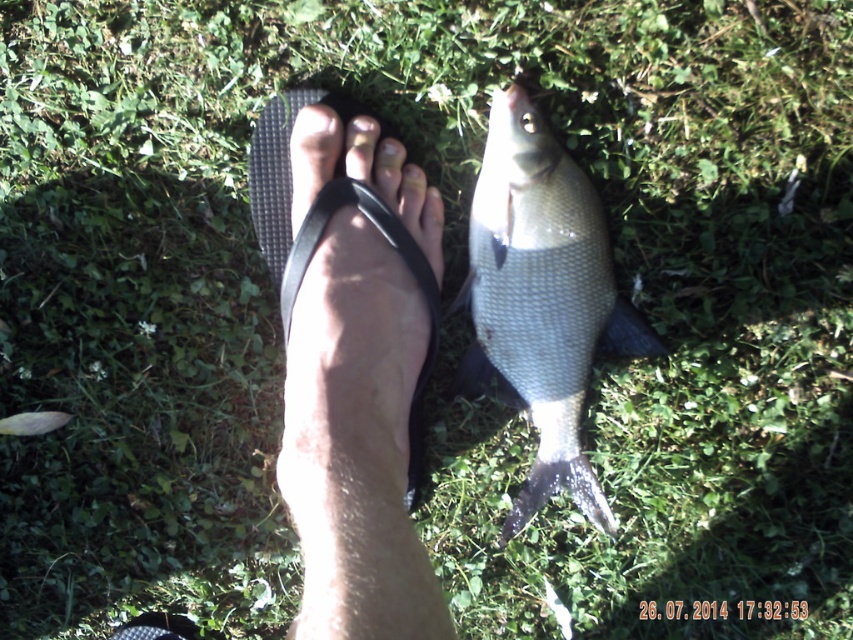
You are a photographer aiming to capture the shiny silver fish at center and the matte black toe at center in a single shot. Based on their positions, will the fish be visible behind the toe or in front of it?

The shiny silver fish at center is located below matte black toe at center, so the fish will be visible behind the toe in the photo.

You are standing in a park and see two points marked on the ground. The first point is at coordinates point (363, 212) and the second is at point (358, 122). Which point is closer to you?

Point (363, 212) is closer to the viewer than point (358, 122).